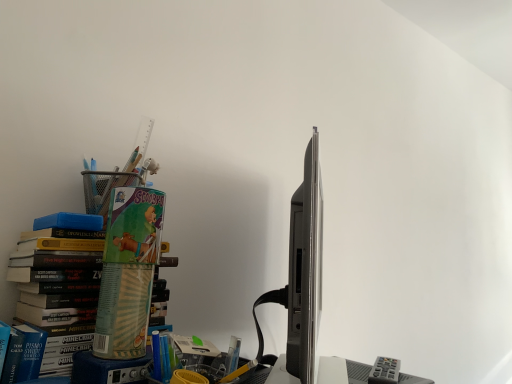
In order to click on satin silver monitor at right in this screenshot , I will do `click(305, 268)`.

What is the approximate width of satin silver monitor at right?

The width of satin silver monitor at right is 3.96 inches.

The image size is (512, 384). What do you see at coordinates (305, 268) in the screenshot? I see `satin silver monitor at right` at bounding box center [305, 268].

Where is `satin silver monitor at right`? The height and width of the screenshot is (384, 512). satin silver monitor at right is located at coordinates (305, 268).